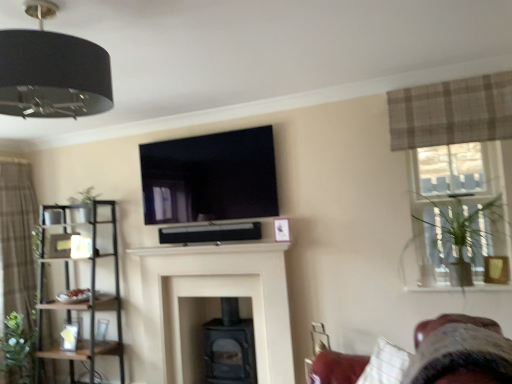
Question: Considering the relative sizes of black fabric lampshade at upper left and brown textured curtain at left, which appears as the 2th curtain when viewed from the front, in the image provided, is black fabric lampshade at upper left wider than brown textured curtain at left, which appears as the 2th curtain when viewed from the front,?

Choices:
 (A) yes
 (B) no

Answer: (A)

Question: Is brown textured curtain at left, which appears as the 2th curtain when viewed from the front, surrounded by black fabric lampshade at upper left?

Choices:
 (A) no
 (B) yes

Answer: (A)

Question: Considering the relative positions of black fabric lampshade at upper left and brown textured curtain at left, the second curtain positioned from the right, in the image provided, is black fabric lampshade at upper left to the left of brown textured curtain at left, the second curtain positioned from the right, from the viewer's perspective?

Choices:
 (A) no
 (B) yes

Answer: (A)

Question: From a real-world perspective, is black fabric lampshade at upper left below brown textured curtain at left, positioned as the second curtain in top-to-bottom order?

Choices:
 (A) yes
 (B) no

Answer: (B)

Question: From a real-world perspective, is black fabric lampshade at upper left on top of brown textured curtain at left, which appears as the 2th curtain when viewed from the front?

Choices:
 (A) yes
 (B) no

Answer: (A)

Question: Is the position of black fabric lampshade at upper left more distant than that of brown textured curtain at left, the 1th curtain positioned from the left?

Choices:
 (A) no
 (B) yes

Answer: (A)

Question: Does black metal shelf at left have a lesser height compared to brown textured curtain at left, the second curtain positioned from the right?

Choices:
 (A) yes
 (B) no

Answer: (A)

Question: Is the surface of black metal shelf at left in direct contact with brown textured curtain at left, which appears as the 2th curtain when viewed from the front?

Choices:
 (A) no
 (B) yes

Answer: (A)

Question: Considering the relative sizes of black metal shelf at left and brown textured curtain at left, the first curtain ordered from the bottom, in the image provided, is black metal shelf at left wider than brown textured curtain at left, the first curtain ordered from the bottom,?

Choices:
 (A) no
 (B) yes

Answer: (B)

Question: Is black metal shelf at left facing away from brown textured curtain at left, the second curtain positioned from the right?

Choices:
 (A) yes
 (B) no

Answer: (B)

Question: Is black metal shelf at left bigger than brown textured curtain at left, which appears as the 2th curtain when viewed from the front?

Choices:
 (A) no
 (B) yes

Answer: (B)

Question: Is black metal shelf at left aimed at brown textured curtain at left, the first curtain in the back-to-front sequence?

Choices:
 (A) yes
 (B) no

Answer: (B)

Question: Does black glossy tv at upper center have a larger size compared to brown textured curtain at left, the second curtain positioned from the right?

Choices:
 (A) no
 (B) yes

Answer: (A)